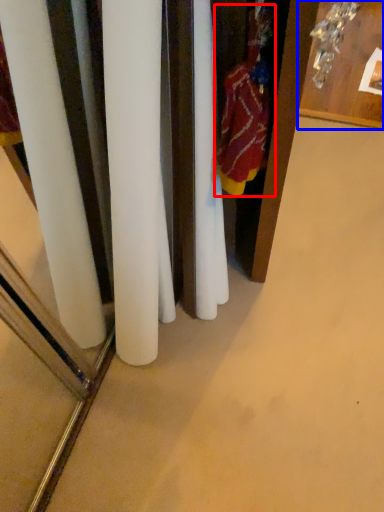
Question: Which of the following is the closest to the observer, clothing (highlighted by a red box) or furniture (highlighted by a blue box)?

Choices:
 (A) clothing
 (B) furniture

Answer: (A)